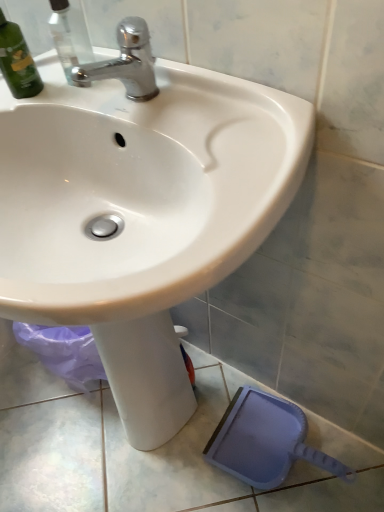
Question: Does point (167, 312) appear closer or farther from the camera than point (23, 35)?

Choices:
 (A) closer
 (B) farther

Answer: (B)

Question: From their relative heights in the image, would you say white glossy sink at upper center is taller or shorter than green matte bottle at upper left?

Choices:
 (A) short
 (B) tall

Answer: (B)

Question: Which object is the closest to the green matte bottle at upper left?

Choices:
 (A) chrome metallic faucet at upper center
 (B) white glossy sink at upper center

Answer: (A)

Question: Estimate the real-world distances between objects in this image. Which object is farther from the white glossy sink at upper center?

Choices:
 (A) chrome metallic faucet at upper center
 (B) green matte bottle at upper left

Answer: (B)